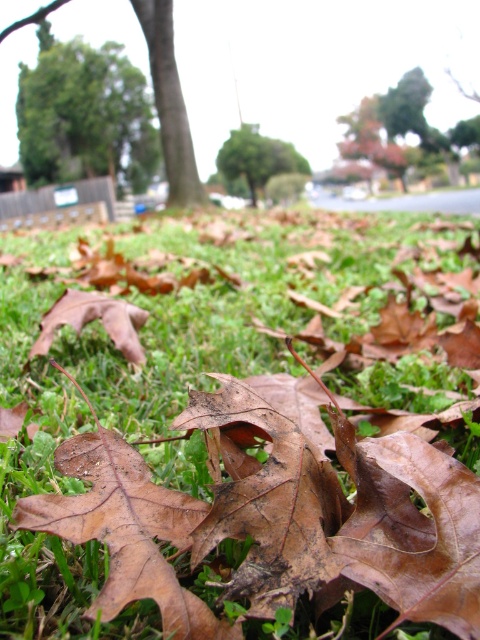
Question: Observing the image, what is the correct spatial positioning of green leafy tree at upper left in reference to green leafy tree at center?

Choices:
 (A) left
 (B) right

Answer: (A)

Question: Is green matte grass at center thinner than green leafy tree at center?

Choices:
 (A) no
 (B) yes

Answer: (A)

Question: Estimate the real-world distances between objects in this image. Which object is farther from the green matte grass at center?

Choices:
 (A) green leafy tree at upper left
 (B) green leafy tree at center

Answer: (A)

Question: In this image, where is green matte grass at center located relative to green leafy tree at center?

Choices:
 (A) above
 (B) below

Answer: (B)

Question: Among these objects, which one is farthest from the camera?

Choices:
 (A) green matte grass at center
 (B) green leafy tree at upper left

Answer: (B)

Question: Estimate the real-world distances between objects in this image. Which object is closer to the green leafy tree at center?

Choices:
 (A) green matte grass at center
 (B) green leafy tree at upper left

Answer: (B)